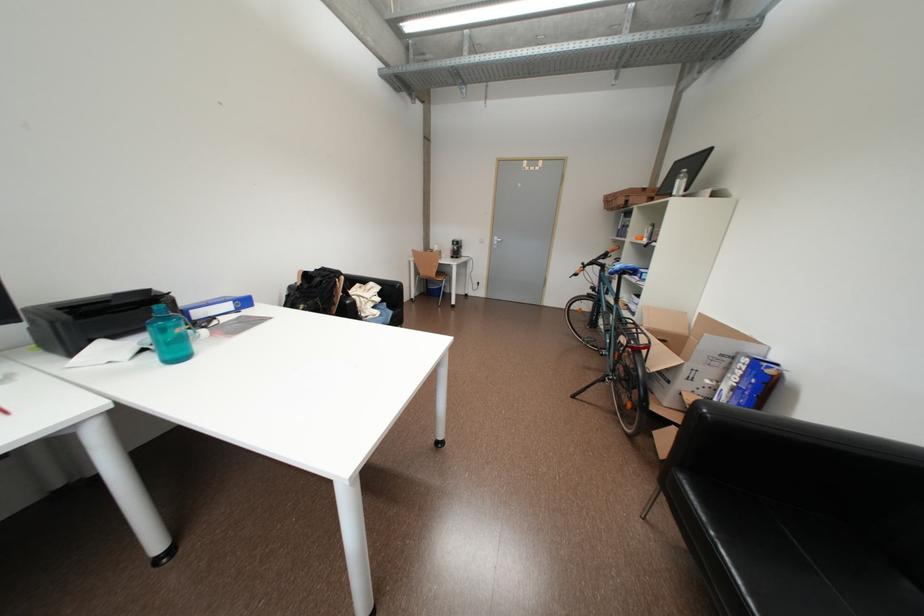
What are the coordinates of `blue bicycle saddle` in the screenshot? It's located at (622, 270).